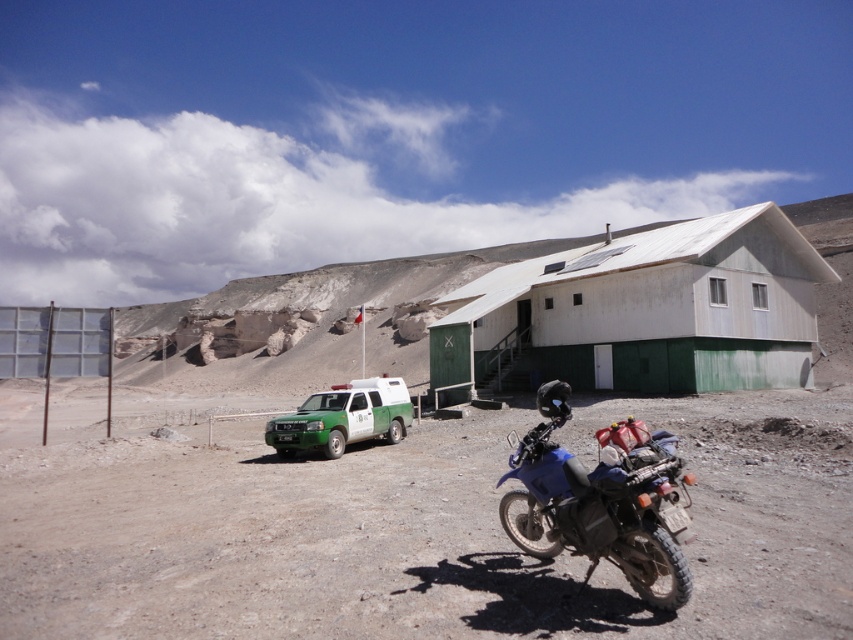
Question: Is dirt/dry ground at center closer to camera compared to blue matte motorcycle at center?

Choices:
 (A) no
 (B) yes

Answer: (A)

Question: Estimate the real-world distances between objects in this image. Which object is farther from the green matte utility vehicle at lower left?

Choices:
 (A) blue matte motorcycle at center
 (B) dirt/dry ground at center
 (C) white matte hut at center

Answer: (C)

Question: Can you confirm if blue matte motorcycle at center is positioned to the left of green matte utility vehicle at lower left?

Choices:
 (A) no
 (B) yes

Answer: (A)

Question: Does blue matte motorcycle at center have a lesser width compared to green matte utility vehicle at lower left?

Choices:
 (A) yes
 (B) no

Answer: (A)

Question: Estimate the real-world distances between objects in this image. Which object is closer to the white matte hut at center?

Choices:
 (A) dirt/dry ground at center
 (B) blue matte motorcycle at center

Answer: (A)

Question: Which object is positioned closest to the green matte utility vehicle at lower left?

Choices:
 (A) blue matte motorcycle at center
 (B) dirt/dry ground at center
 (C) white matte hut at center

Answer: (B)